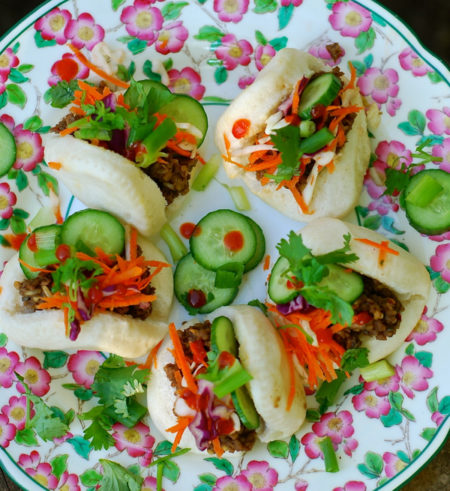
At what (x,y) coordinates should I click in order to perform the action: click on plate. Please return your answer as a coordinate pair (x, y). Looking at the image, I should click on (200, 21).